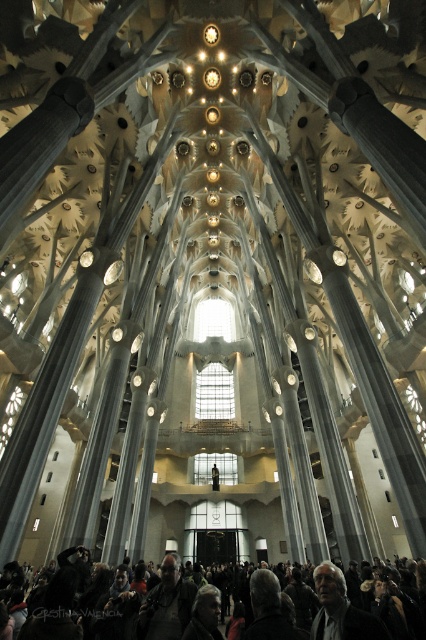
You are standing in the cathedral and see the dark gray fabric crowd at lower center and the gray hair at center. Which object is closer to your left side?

The dark gray fabric crowd at lower center is positioned on the left side of gray hair at center, so it is closer to your left side.